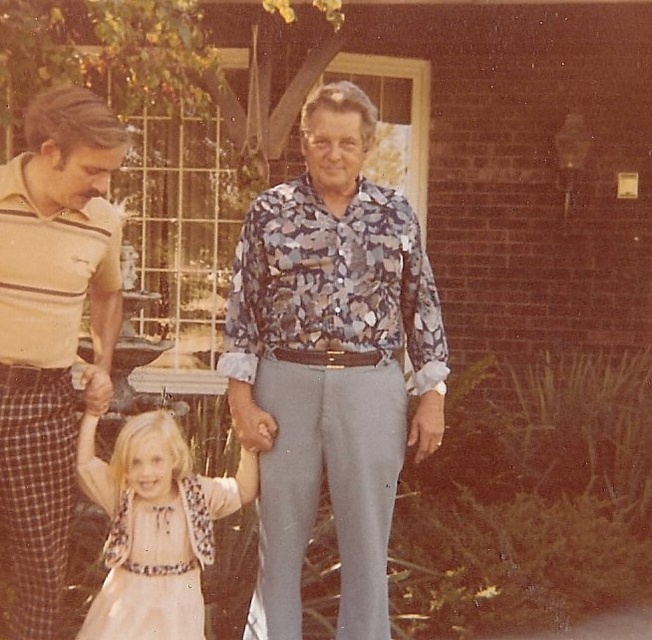
Is floral print shirt at center positioned behind pastel pink satin dress at center?

No.

Which is more to the left, floral print shirt at center or pastel pink satin dress at center?

pastel pink satin dress at center

Consider the image. Who is more distant from viewer, [391,385] or [119,502]?

Positioned behind is point [119,502].

Locate an element on the screen. The image size is (652, 640). floral print shirt at center is located at coordinates (331, 364).

Between striped cotton shirt at left and pastel pink satin dress at center, which one is positioned higher?

striped cotton shirt at left is higher up.

Is striped cotton shirt at left below pastel pink satin dress at center?

No.

Is point (55, 536) positioned behind point (175, 596)?

No, (55, 536) is closer to viewer.

What are the coordinates of `striped cotton shirt at left` in the screenshot? It's located at (52, 328).

Who is positioned more to the right, floral print shirt at center or striped cotton shirt at left?

floral print shirt at center is more to the right.

Locate an element on the screen. floral print shirt at center is located at coordinates [331, 364].

Identify the location of floral print shirt at center. The image size is (652, 640). pos(331,364).